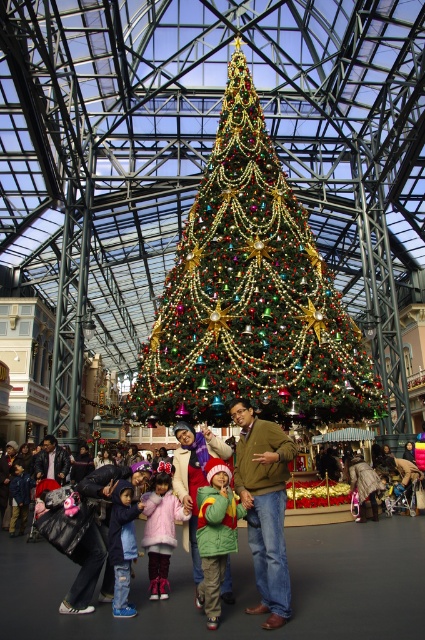
The height and width of the screenshot is (640, 425). What do you see at coordinates (263, 506) in the screenshot? I see `green knitted sweater at center` at bounding box center [263, 506].

Between green knitted sweater at center and denim jacket at lower left, which one has more height?

green knitted sweater at center

Is point (252, 452) less distant than point (122, 566)?

No.

Locate an element on the screen. green knitted sweater at center is located at coordinates (263, 506).

Identify the location of green fuzzy coat at center. Image resolution: width=425 pixels, height=640 pixels. (215, 536).

Is point (214, 612) positioned behind point (164, 560)?

No.

Between point (220, 472) and point (156, 515), which one is positioned behind?

Positioned behind is point (156, 515).

Image resolution: width=425 pixels, height=640 pixels. Identify the location of green fuzzy coat at center. (215, 536).

Does iridescent gold christmas tree at center have a greater width compared to green knitted sweater at center?

Indeed, iridescent gold christmas tree at center has a greater width compared to green knitted sweater at center.

Can you confirm if iridescent gold christmas tree at center is positioned to the left of green knitted sweater at center?

Incorrect, iridescent gold christmas tree at center is not on the left side of green knitted sweater at center.

Between point (201, 227) and point (272, 611), which one is positioned behind?

The point (201, 227) is more distant.

This screenshot has height=640, width=425. In order to click on iridescent gold christmas tree at center in this screenshot , I will do `click(251, 296)`.